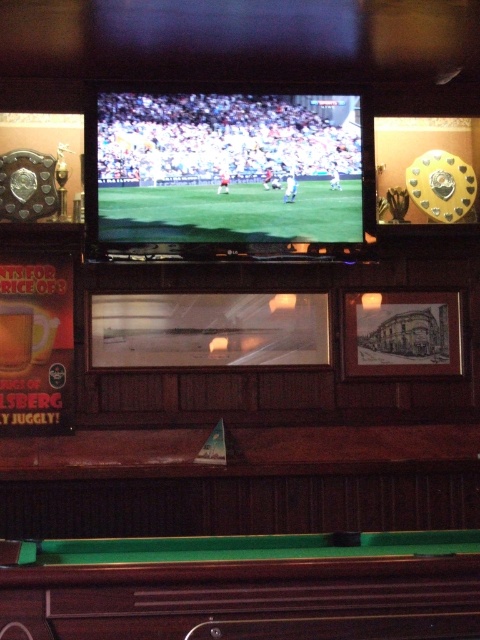
Question: Which of the following is the farthest from the observer?

Choices:
 (A) green felt pool table at bottom
 (B) matte green screen at center

Answer: (B)

Question: Where is green felt pool table at bottom located in relation to matte green screen at center in the image?

Choices:
 (A) right
 (B) left

Answer: (A)

Question: Can you confirm if green felt pool table at bottom is smaller than matte green screen at center?

Choices:
 (A) yes
 (B) no

Answer: (B)

Question: Does green felt pool table at bottom appear over matte green screen at center?

Choices:
 (A) yes
 (B) no

Answer: (B)